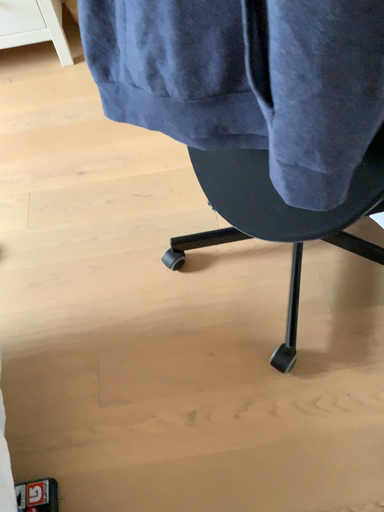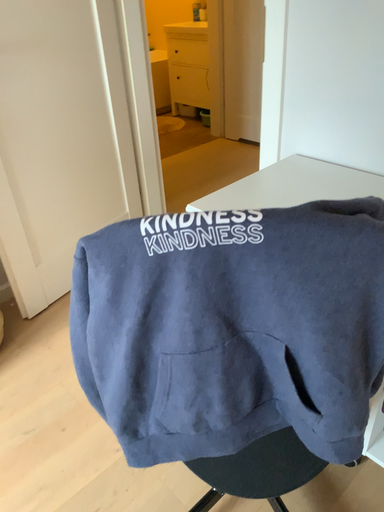
Question: Which way did the camera rotate in the video?

Choices:
 (A) rotated downward
 (B) rotated upward

Answer: (B)